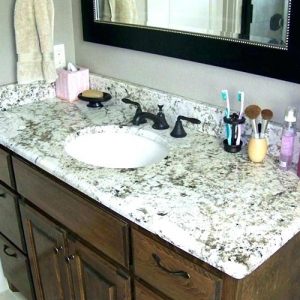
Locate an element on the screen. towel is located at coordinates (28, 25).